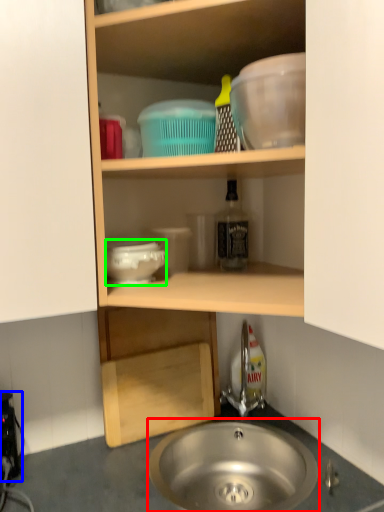
Question: Based on their relative distances, which object is nearer to sink (highlighted by a red box)? Choose from appliance (highlighted by a blue box) and basin (highlighted by a green box).

Choices:
 (A) appliance
 (B) basin

Answer: (A)